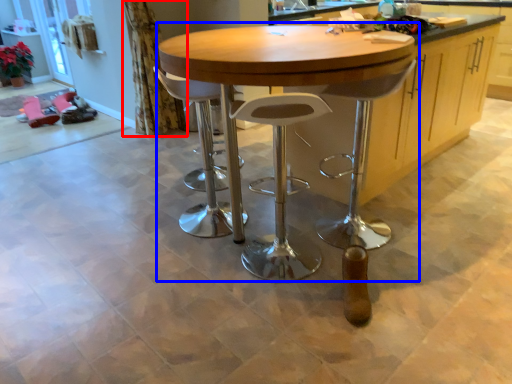
Question: Which point is closer to the camera, curtain (highlighted by a red box) or table (highlighted by a blue box)?

Choices:
 (A) curtain
 (B) table

Answer: (B)